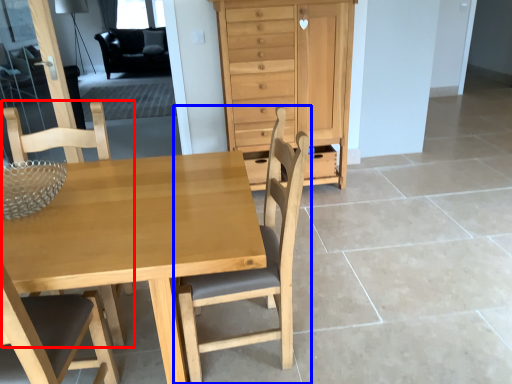
Question: Among these objects, which one is farthest to the camera, chair (highlighted by a red box) or chair (highlighted by a blue box)?

Choices:
 (A) chair
 (B) chair

Answer: (A)